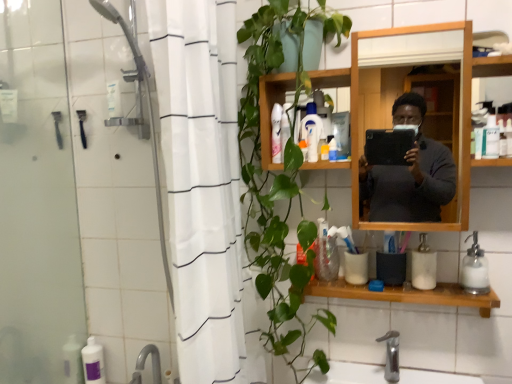
Measure the distance between point (285, 128) and camera.

1.27 meters.

In order to face white glass soap dispenser at lower right, the 1th soap dispenser when ordered from right to left, should I rotate leftwards or rightwards?

It's best to rotate right around 27.536 degrees.

What do you see at coordinates (204, 188) in the screenshot? This screenshot has width=512, height=384. I see `white fabric shower curtain at left` at bounding box center [204, 188].

What is the approximate width of transparent glass screen door at left?

transparent glass screen door at left is 1.19 inches wide.

This screenshot has width=512, height=384. Describe the element at coordinates (490, 137) in the screenshot. I see `white plastic container at upper right, which ranks as the eighth toiletry in left-to-right order` at that location.

Locate an element on the screen. The height and width of the screenshot is (384, 512). white plastic bottle at upper center, which is counted as the fourth toiletry, starting from the front is located at coordinates (312, 141).

Which object is thinner, white plastic bottle at upper center, acting as the fourth toiletry starting from the bottom, or translucent plastic toothbrush at upper center, the 7th toiletry when ordered from left to right?

With smaller width is white plastic bottle at upper center, acting as the fourth toiletry starting from the bottom.

Considering the points (307, 126) and (330, 151), which point is in front, point (307, 126) or point (330, 151)?

Point (307, 126)

Can you tell me how much white plastic bottle at upper center, which is counted as the 5th toiletry, starting from the back, and translucent plastic toothbrush at upper center, the 2th toiletry when ordered from right to left, differ in facing direction?

The angular difference between white plastic bottle at upper center, which is counted as the 5th toiletry, starting from the back, and translucent plastic toothbrush at upper center, the 2th toiletry when ordered from right to left, is 48.9 degrees.

From a real-world perspective, is white plastic bottle at upper center, which is counted as the fourth toiletry, starting from the front, physically located above or below translucent plastic toothbrush at upper center, the 6th toiletry viewed from the back?

Clearly, from a real-world perspective, white plastic bottle at upper center, which is counted as the fourth toiletry, starting from the front, is above translucent plastic toothbrush at upper center, the 6th toiletry viewed from the back.

From the image's perspective, which is above, transparent glass screen door at left or purple matte bottle at lower left, the 8th toiletry viewed from the right?

From the image's view, transparent glass screen door at left is above.

From a real-world perspective, between transparent glass screen door at left and purple matte bottle at lower left, the 8th toiletry viewed from the right, who is vertically lower?

purple matte bottle at lower left, the 8th toiletry viewed from the right, is physically lower.

Is transparent glass screen door at left further to the viewer compared to purple matte bottle at lower left, the first toiletry in the back-to-front sequence?

No, transparent glass screen door at left is closer to the camera.

Between transparent glass screen door at left and purple matte bottle at lower left, the 8th toiletry viewed from the right, which one has smaller width?

With smaller width is transparent glass screen door at left.

Is transparent glass screen door at left taller or shorter than white plastic bottle at upper center, which is counted as the first toiletry, starting from the top?

In the image, transparent glass screen door at left appears to be taller than white plastic bottle at upper center, which is counted as the first toiletry, starting from the top.

Can you see transparent glass screen door at left touching white plastic bottle at upper center, marked as the fifth toiletry in a left-to-right arrangement?

transparent glass screen door at left and white plastic bottle at upper center, marked as the fifth toiletry in a left-to-right arrangement, are not in contact.

Is white plastic bottle at upper center, arranged as the 8th toiletry when ordered from the bottom, completely or partially inside transparent glass screen door at left?

No, white plastic bottle at upper center, arranged as the 8th toiletry when ordered from the bottom, is not inside transparent glass screen door at left.

Which object is further away from the camera, transparent glass screen door at left or white plastic bottle at upper center, arranged as the 8th toiletry when ordered from the bottom?

Positioned behind is white plastic bottle at upper center, arranged as the 8th toiletry when ordered from the bottom.

Which is closer to the camera, (95, 353) or (310, 132)?

Clearly, point (95, 353) is more distant from the camera than point (310, 132).

Can white plastic bottle at upper center, the 5th toiletry in the top-to-bottom sequence, be found inside purple matte bottle at lower left, the 8th toiletry in the top-to-bottom sequence?

No, white plastic bottle at upper center, the 5th toiletry in the top-to-bottom sequence, is not a part of purple matte bottle at lower left, the 8th toiletry in the top-to-bottom sequence.

Which of these two, purple matte bottle at lower left, which is the first toiletry in left-to-right order, or white plastic bottle at upper center, the 5th toiletry in the top-to-bottom sequence, is smaller?

With smaller size is white plastic bottle at upper center, the 5th toiletry in the top-to-bottom sequence.

Is purple matte bottle at lower left, which is the first toiletry in left-to-right order, further to the viewer compared to white plastic bottle at upper center, placed as the fourth toiletry when sorted from left to right?

Yes, the depth of purple matte bottle at lower left, which is the first toiletry in left-to-right order, is greater than that of white plastic bottle at upper center, placed as the fourth toiletry when sorted from left to right.

Is white marble soap dispenser at lower right, acting as the first soap dispenser starting from the left, taller than white plastic bottle at upper center, which is counted as the first toiletry, starting from the top?

Incorrect, the height of white marble soap dispenser at lower right, acting as the first soap dispenser starting from the left, is not larger of that of white plastic bottle at upper center, which is counted as the first toiletry, starting from the top.

From the image's perspective, is white marble soap dispenser at lower right, acting as the first soap dispenser starting from the left, on white plastic bottle at upper center, marked as the fifth toiletry in a left-to-right arrangement?

Incorrect, from the image's perspective, white marble soap dispenser at lower right, acting as the first soap dispenser starting from the left, is lower than white plastic bottle at upper center, marked as the fifth toiletry in a left-to-right arrangement.

Considering the relative sizes of white marble soap dispenser at lower right, the 2th soap dispenser from the right, and white plastic bottle at upper center, positioned as the third toiletry in back-to-front order, in the image provided, is white marble soap dispenser at lower right, the 2th soap dispenser from the right, smaller than white plastic bottle at upper center, positioned as the third toiletry in back-to-front order,?

No.

Is white marble soap dispenser at lower right, the 2th soap dispenser from the right, not within white plastic bottle at upper center, arranged as the 8th toiletry when ordered from the bottom?

That's correct, white marble soap dispenser at lower right, the 2th soap dispenser from the right, is outside of white plastic bottle at upper center, arranged as the 8th toiletry when ordered from the bottom.

From a real-world perspective, which is physically above, white glass soap dispenser at lower right, acting as the 2th soap dispenser starting from the left, or white plastic tube at upper center, positioned as the second toiletry in top-to-bottom order?

white plastic tube at upper center, positioned as the second toiletry in top-to-bottom order, is physically above.

Would you say white plastic tube at upper center, placed as the 7th toiletry when sorted from front to back, is part of white glass soap dispenser at lower right, acting as the 2th soap dispenser starting from the left,'s contents?

That's incorrect, white plastic tube at upper center, placed as the 7th toiletry when sorted from front to back, is not inside white glass soap dispenser at lower right, acting as the 2th soap dispenser starting from the left.

Is white glass soap dispenser at lower right, the 1th soap dispenser when ordered from right to left, to the left or to the right of white plastic tube at upper center, placed as the 7th toiletry when sorted from front to back, in the image?

white glass soap dispenser at lower right, the 1th soap dispenser when ordered from right to left, is to the right of white plastic tube at upper center, placed as the 7th toiletry when sorted from front to back.

Identify the location of the 1st toiletry counting from the left side of the translucent plastic toothbrush holder at upper center, which appears as the 6th toiletry when viewed from the right. (276, 133).

In the scene shown: What's the angular difference between white plastic tube at upper center, the seventh toiletry in the right-to-left sequence, and translucent plastic toothbrush holder at upper center, the 3th toiletry positioned from the top,'s facing directions?

0.00652 degrees separate the facing orientations of white plastic tube at upper center, the seventh toiletry in the right-to-left sequence, and translucent plastic toothbrush holder at upper center, the 3th toiletry positioned from the top.

Who is bigger, white plastic tube at upper center, the seventh toiletry in the right-to-left sequence, or translucent plastic toothbrush holder at upper center, which appears as the third toiletry when viewed from the left?

white plastic tube at upper center, the seventh toiletry in the right-to-left sequence, is bigger.

Which of these two, white plastic tube at upper center, which is the second toiletry from left to right, or translucent plastic toothbrush holder at upper center, which appears as the third toiletry when viewed from the left, is thinner?

Thinner between the two is translucent plastic toothbrush holder at upper center, which appears as the third toiletry when viewed from the left.

The image size is (512, 384). In order to click on the 2nd toiletry below the white plastic bottle at upper center, which is counted as the 5th toiletry, starting from the back (from the image's perspective) in this screenshot , I will do `click(332, 150)`.

Where is `the 1st toiletry to the right of the transparent glass screen door at left, starting your count from the anchor`? This screenshot has height=384, width=512. the 1st toiletry to the right of the transparent glass screen door at left, starting your count from the anchor is located at coordinates (93, 362).

Which object lies further to the anchor point transparent glass screen door at left, white fabric shower curtain at left or wooden shelf at lower center?

Based on the image, wooden shelf at lower center appears to be further to transparent glass screen door at left.

Considering their positions, is white fabric shower curtain at left positioned further to white plastic bottle at upper center, positioned as the third toiletry in back-to-front order, than white plastic bottle at upper center, acting as the fourth toiletry starting from the bottom?

white fabric shower curtain at left lies further to white plastic bottle at upper center, positioned as the third toiletry in back-to-front order, than the other object.

From the image, which object appears to be farther from white plastic tube at upper center, which is the 7th toiletry from bottom to top, translucent plastic bottle at center, the third toiletry in the bottom-to-top sequence, or white marble soap dispenser at lower right, acting as the first soap dispenser starting from the left?

Based on the image, white marble soap dispenser at lower right, acting as the first soap dispenser starting from the left, appears to be further to white plastic tube at upper center, which is the 7th toiletry from bottom to top.

Looking at the image, which one is located closer to transparent glass screen door at left, white plastic bottle at upper center, acting as the fourth toiletry starting from the bottom, or translucent plastic bottle at center, which ranks as the 5th toiletry in front-to-back order?

white plastic bottle at upper center, acting as the fourth toiletry starting from the bottom, is positioned closer to the anchor transparent glass screen door at left.

When comparing their distances from white fabric shower curtain at left, does white glass soap dispenser at lower right, the 1th soap dispenser when ordered from right to left, or purple matte bottle at lower left, placed as the 8th toiletry when sorted from front to back, seem closer?

white glass soap dispenser at lower right, the 1th soap dispenser when ordered from right to left.

From the picture: From the image, which object appears to be farther from white plastic tube at upper center, which is the 7th toiletry from bottom to top, white fabric shower curtain at left or white plastic bottle at upper center, acting as the fourth toiletry starting from the bottom?

Among the two, white fabric shower curtain at left is located further to white plastic tube at upper center, which is the 7th toiletry from bottom to top.

From the picture: Considering their positions, is purple matte bottle at lower left, the 1th toiletry ordered from the bottom, positioned further to white fabric shower curtain at left than transparent glass screen door at left?

purple matte bottle at lower left, the 1th toiletry ordered from the bottom, is positioned further to the anchor white fabric shower curtain at left.

Estimate the real-world distances between objects in this image. Which object is closer to white marble soap dispenser at lower right, acting as the first soap dispenser starting from the left, white fabric shower curtain at left or wooden shelf at lower center?

Among the two, wooden shelf at lower center is located nearer to white marble soap dispenser at lower right, acting as the first soap dispenser starting from the left.

The height and width of the screenshot is (384, 512). I want to click on shower curtain situated between transparent glass screen door at left and white marble soap dispenser at lower right, the 2th soap dispenser from the right, from left to right, so click(204, 188).

Where is `houseplant between white plastic tube at upper center, which is the second toiletry from left to right, and purple matte bottle at lower left, placed as the 8th toiletry when sorted from front to back, from top to bottom`? This screenshot has height=384, width=512. houseplant between white plastic tube at upper center, which is the second toiletry from left to right, and purple matte bottle at lower left, placed as the 8th toiletry when sorted from front to back, from top to bottom is located at coordinates (279, 176).

Find the location of a particular element. This screenshot has width=512, height=384. houseplant situated between transparent glass screen door at left and white plastic bottle at upper center, arranged as the 8th toiletry when ordered from the bottom, from left to right is located at coordinates (279, 176).

The image size is (512, 384). What are the coordinates of `soap dispenser between translucent plastic toothbrush holder at upper center, which is counted as the 6th toiletry, starting from the bottom, and white glass soap dispenser at lower right, acting as the 2th soap dispenser starting from the left, in the horizontal direction` in the screenshot? It's located at (423, 265).